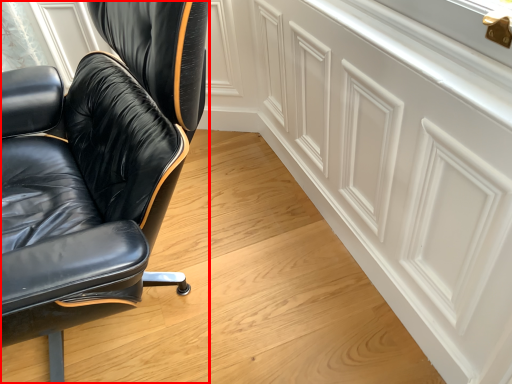
Question: In this image, where is chair (annotated by the red box) located relative to cabinetry?

Choices:
 (A) right
 (B) left

Answer: (B)